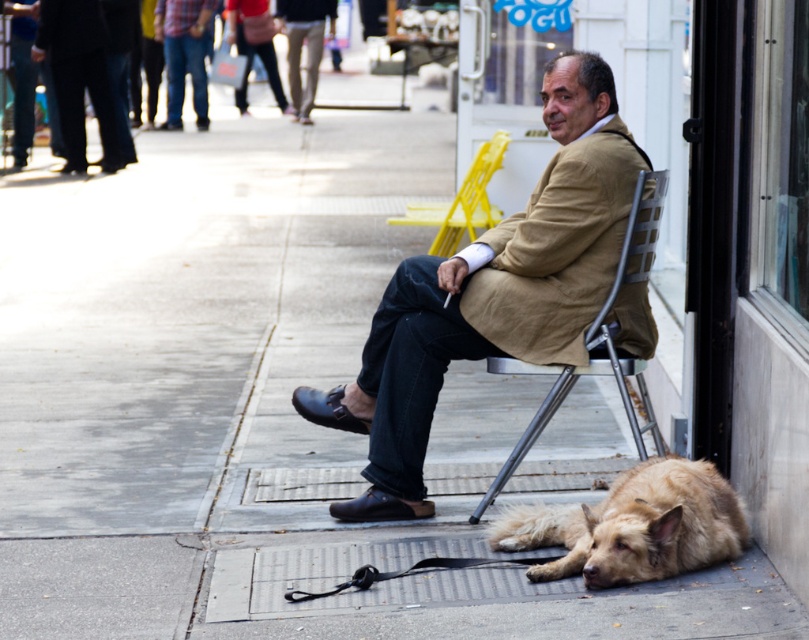
Question: Where is brown leather jacket at center located in relation to metallic silver folding chair at center in the image?

Choices:
 (A) left
 (B) right

Answer: (A)

Question: Which point is closer to the camera?

Choices:
 (A) fuzzy brown fur at lower right
 (B) metallic silver folding chair at center
 (C) yellow plastic chair at center
 (D) brown leather jacket at center

Answer: (A)

Question: Does brown leather jacket at center have a larger size compared to yellow plastic chair at center?

Choices:
 (A) yes
 (B) no

Answer: (B)

Question: Which of these objects is positioned closest to the yellow plastic chair at center?

Choices:
 (A) fuzzy brown fur at lower right
 (B) brown leather jacket at center
 (C) metallic silver folding chair at center

Answer: (B)

Question: Which object is the closest to the metallic silver folding chair at center?

Choices:
 (A) fuzzy brown fur at lower right
 (B) yellow plastic chair at center

Answer: (A)

Question: Can you confirm if fuzzy brown fur at lower right is positioned above metallic silver folding chair at center?

Choices:
 (A) yes
 (B) no

Answer: (B)